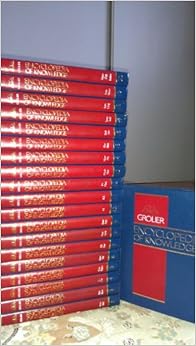
At what (x,y) coordinates should I click in order to perform the action: click on book volume numbers. Please return your answer as a coordinate pair (x, y). Looking at the image, I should click on (99, 306), (100, 293), (99, 279), (98, 268), (101, 257), (103, 244), (103, 233), (106, 134), (104, 198).